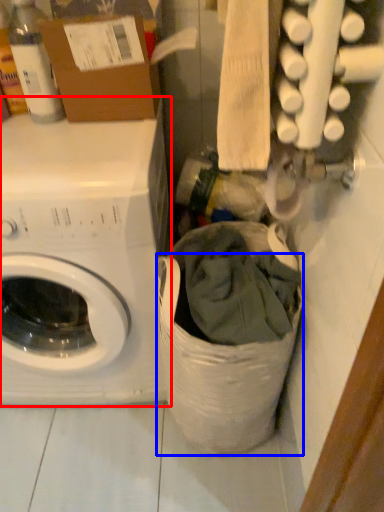
Question: Which object appears closest to the camera in this image, washing machine (highlighted by a red box) or laundry basket (highlighted by a blue box)?

Choices:
 (A) washing machine
 (B) laundry basket

Answer: (B)